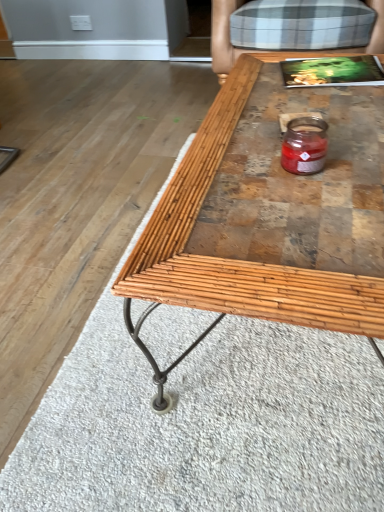
This screenshot has width=384, height=512. What are the coordinates of `vacant area on the back side of translucent glass candle at center` in the screenshot? It's located at (278, 132).